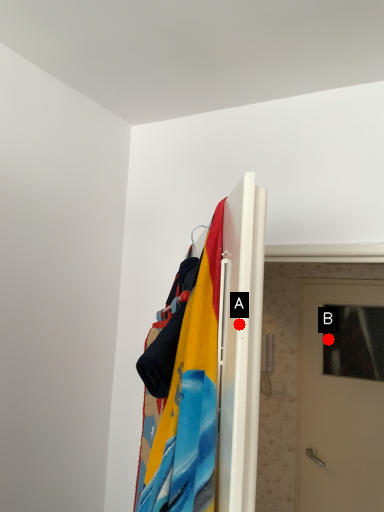
Question: Two points are circled on the image, labeled by A and B beside each circle. Which point is further to the camera?

Choices:
 (A) A is further
 (B) B is further

Answer: (B)